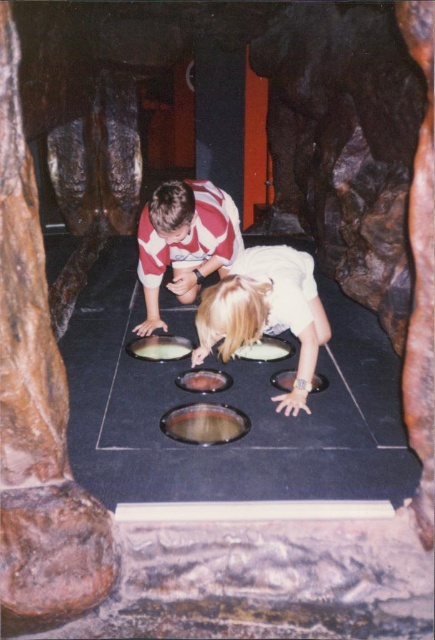
Between striped jersey at center and white matte food at center, which one has less height?

white matte food at center

Between point (187, 189) and point (181, 348), which one is positioned behind?

The point (181, 348) is behind.

Identify the location of striped jersey at center. (184, 241).

Which is above, white matte food at center or matte plastic food at center?

white matte food at center

Between white matte food at center and matte plastic food at center, which one is positioned lower?

matte plastic food at center is lower down.

Describe the element at coordinates (160, 348) in the screenshot. The image size is (435, 640). I see `white matte food at center` at that location.

Image resolution: width=435 pixels, height=640 pixels. What are the coordinates of `white matte food at center` in the screenshot? It's located at (160, 348).

Does white creamy food at center appear over matte plastic food at center?

Yes.

Between point (267, 340) and point (320, 376), which one is positioned behind?

The point (267, 340) is more distant.

You are a GUI agent. You are given a task and a screenshot of the screen. Output one action in this format:
    pyautogui.click(x=<x>, y=<y>)
    Task: Click on the white creamy food at center
    Image resolution: width=435 pixels, height=640 pixels.
    Given the screenshot: What is the action you would take?
    pyautogui.click(x=264, y=349)